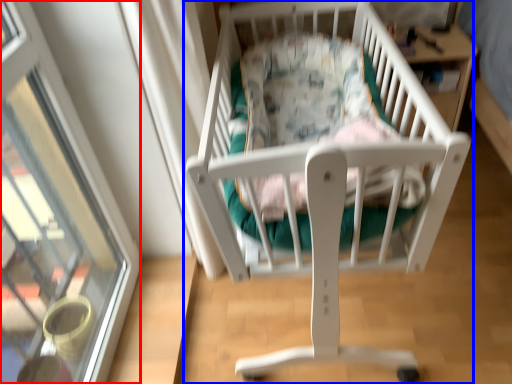
Question: Among these objects, which one is nearest to the camera, glass door (highlighted by a red box) or infant bed (highlighted by a blue box)?

Choices:
 (A) glass door
 (B) infant bed

Answer: (A)